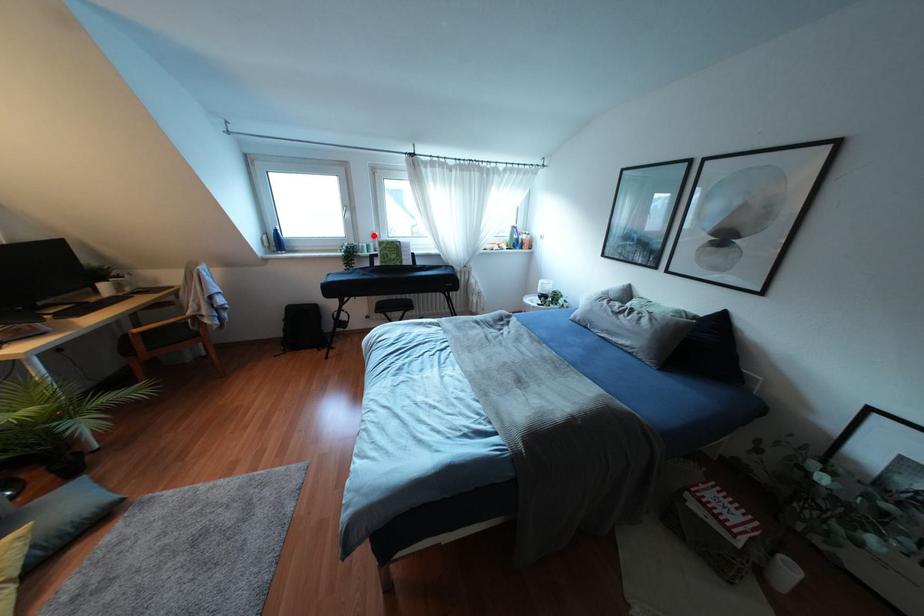
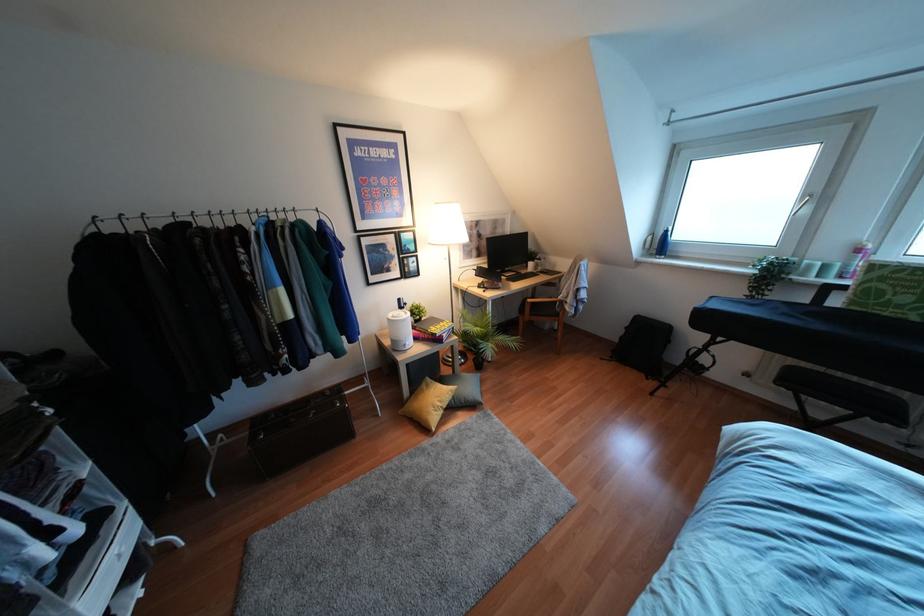
Find the pixel in the second image that matches the highlighted location in the first image.

(858, 249)